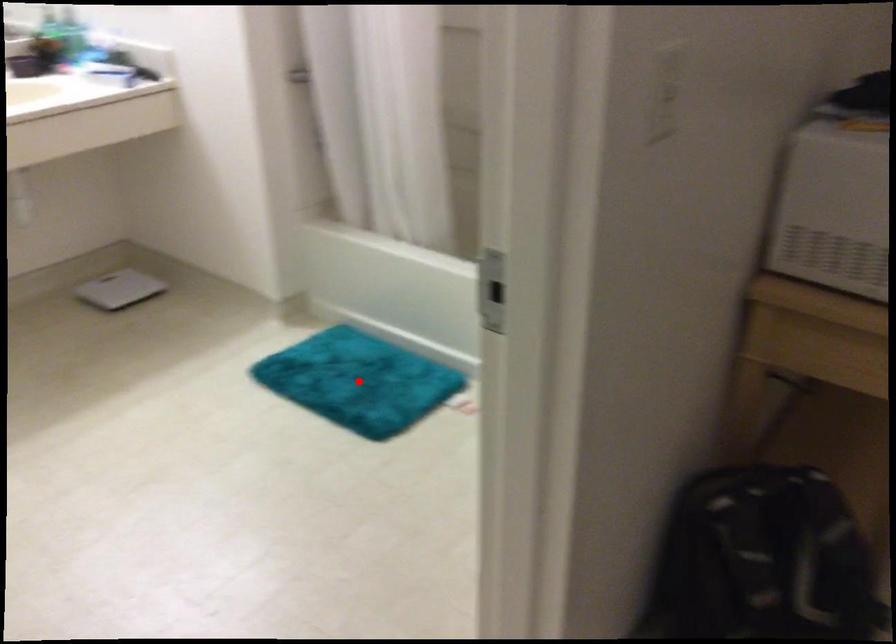
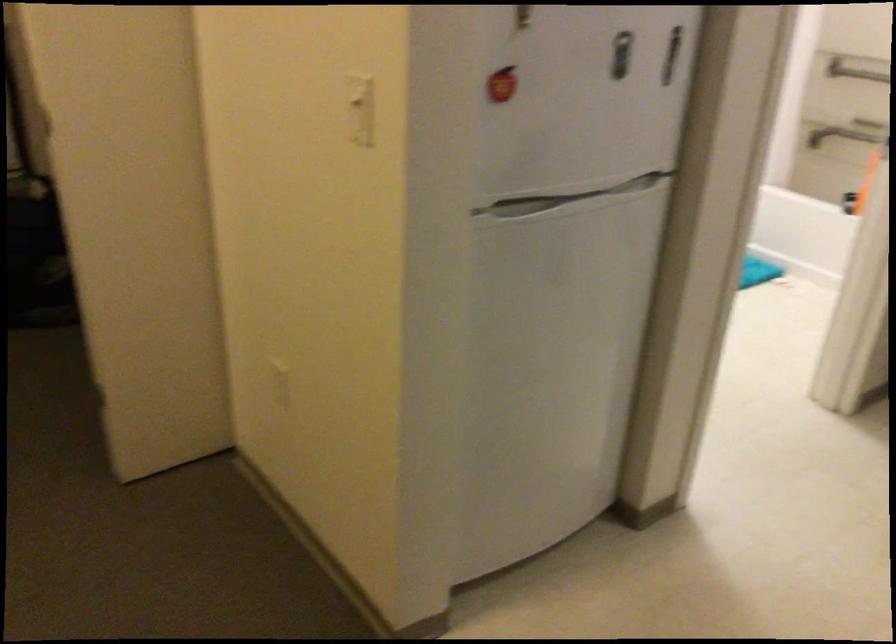
Question: I am providing you with two images of the same scene from different viewpoints. A red point is marked on the first image. Is the red point's position out of view in image 2?

Choices:
 (A) Yes
 (B) No

Answer: (A)